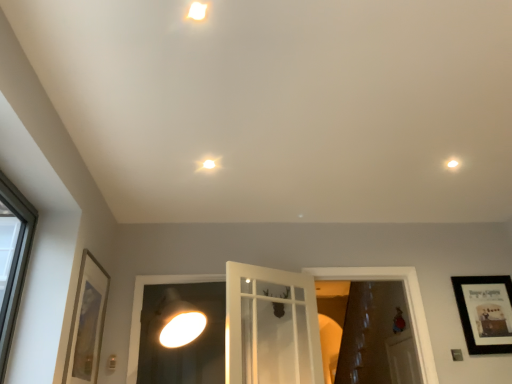
I want to click on white glossy door at center, positioned as the 1th window frame in right-to-left order, so click(x=407, y=301).

Where is `gold-framed picture at left, the 2th picture frame positioned from the back`? The height and width of the screenshot is (384, 512). gold-framed picture at left, the 2th picture frame positioned from the back is located at coordinates (87, 322).

What do you see at coordinates (142, 305) in the screenshot?
I see `white glass door at center, positioned as the second window frame in right-to-left order` at bounding box center [142, 305].

Identify the location of white glossy door at center, positioned as the 1th window frame in right-to-left order. The image size is (512, 384). (407, 301).

Which is in front, point (196, 10) or point (454, 166)?

Positioned in front is point (196, 10).

From the image's perspective, is white glossy droplight at upper center, the 2th droplight when ordered from left to right, above or below white glossy droplight at upper right, the 3th droplight viewed from the left?

white glossy droplight at upper center, the 2th droplight when ordered from left to right, is situated higher than white glossy droplight at upper right, the 3th droplight viewed from the left, in the image.

From a real-world perspective, which is physically above, white glossy droplight at upper center, the 2th droplight when ordered from left to right, or white glossy droplight at upper right, marked as the 3th droplight in a front-to-back arrangement?

white glossy droplight at upper right, marked as the 3th droplight in a front-to-back arrangement, from a real-world perspective.

Which of these two, white glossy droplight at upper center, acting as the 3th droplight starting from the bottom, or white glossy droplight at upper right, marked as the 3th droplight in a front-to-back arrangement, stands taller?

With more height is white glossy droplight at upper right, marked as the 3th droplight in a front-to-back arrangement.

Which object is positioned more to the left, white glossy droplight at upper right, the 1th droplight viewed from the right, or matte white droplight at center, placed as the 1th droplight when sorted from bottom to top?

matte white droplight at center, placed as the 1th droplight when sorted from bottom to top, is more to the left.

From a real-world perspective, is white glossy droplight at upper right, which is counted as the second droplight, starting from the bottom, located higher than matte white droplight at center, placed as the 1th droplight when sorted from bottom to top?

Yes, from a real-world perspective, white glossy droplight at upper right, which is counted as the second droplight, starting from the bottom, is on top of matte white droplight at center, placed as the 1th droplight when sorted from bottom to top.

Is white glossy droplight at upper right, marked as the 3th droplight in a front-to-back arrangement, far away from matte white droplight at center, which appears as the 3th droplight when viewed from the right?

Yes.

In the scene shown: Is gold-framed picture at left, the 2th picture frame positioned from the back, with matte white droplight at center, placed as the 1th droplight when sorted from bottom to top?

They are not placed beside each other.

Who is shorter, gold-framed picture at left, which is counted as the 1th picture frame, starting from the front, or matte white droplight at center, which appears as the third droplight when viewed from the top?

With less height is matte white droplight at center, which appears as the third droplight when viewed from the top.

You are a GUI agent. You are given a task and a screenshot of the screen. Output one action in this format:
    pyautogui.click(x=<x>, y=<y>)
    Task: Click on the 1st droplight behind the gold-framed picture at left, the 2th picture frame positioned from the back
    The image size is (512, 384).
    Given the screenshot: What is the action you would take?
    pyautogui.click(x=209, y=164)

Can you confirm if white glossy door at center, placed as the second window frame when sorted from left to right, is smaller than matte white droplight at center, which appears as the second droplight when viewed from the front?

Incorrect, white glossy door at center, placed as the second window frame when sorted from left to right, is not smaller in size than matte white droplight at center, which appears as the second droplight when viewed from the front.

How different are the orientations of white glossy door at center, positioned as the 1th window frame in right-to-left order, and matte white droplight at center, which appears as the second droplight when viewed from the front, in degrees?

The angle between the facing direction of white glossy door at center, positioned as the 1th window frame in right-to-left order, and the facing direction of matte white droplight at center, which appears as the second droplight when viewed from the front, is 0.7 degrees.

From a real-world perspective, starting from the matte white droplight at center, marked as the 2th droplight in a back-to-front arrangement, which window frame is the 1st one below it? Please provide its 2D coordinates.

[(407, 301)]

Which object is positioned more to the left, white glossy droplight at upper right, the first droplight positioned from the back, or gold-framed picture at left, positioned as the 2th picture frame in right-to-left order?

gold-framed picture at left, positioned as the 2th picture frame in right-to-left order, is more to the left.

Are white glossy droplight at upper right, marked as the 3th droplight in a front-to-back arrangement, and gold-framed picture at left, which is counted as the 1th picture frame, starting from the left, located far from each other?

That's right, there is a large distance between white glossy droplight at upper right, marked as the 3th droplight in a front-to-back arrangement, and gold-framed picture at left, which is counted as the 1th picture frame, starting from the left.

From the image's perspective, is white glossy droplight at upper right, the first droplight positioned from the back, over gold-framed picture at left, the 2th picture frame positioned from the back?

Indeed, from the image's perspective, white glossy droplight at upper right, the first droplight positioned from the back, is shown above gold-framed picture at left, the 2th picture frame positioned from the back.

How many degrees apart are the facing directions of white glossy droplight at upper right, which is counted as the second droplight, starting from the bottom, and gold-framed picture at left, which is counted as the 1th picture frame, starting from the left?

The facing directions of white glossy droplight at upper right, which is counted as the second droplight, starting from the bottom, and gold-framed picture at left, which is counted as the 1th picture frame, starting from the left, are 91.1 degrees apart.

Which of these two, black matte picture frame at upper right, which is counted as the first picture frame, starting from the right, or white glossy droplight at upper right, the first droplight positioned from the back, stands shorter?

white glossy droplight at upper right, the first droplight positioned from the back.

Is black matte picture frame at upper right, which is counted as the first picture frame, starting from the right, facing towards white glossy droplight at upper right, the 3th droplight viewed from the left?

No, black matte picture frame at upper right, which is counted as the first picture frame, starting from the right, is not turned towards white glossy droplight at upper right, the 3th droplight viewed from the left.

Considering the relative sizes of black matte picture frame at upper right, which is counted as the first picture frame, starting from the right, and white glossy droplight at upper right, the 1th droplight viewed from the right, in the image provided, is black matte picture frame at upper right, which is counted as the first picture frame, starting from the right, thinner than white glossy droplight at upper right, the 1th droplight viewed from the right,?

Indeed, black matte picture frame at upper right, which is counted as the first picture frame, starting from the right, has a lesser width compared to white glossy droplight at upper right, the 1th droplight viewed from the right.

Considering the relative positions of black matte picture frame at upper right, the 1th picture frame positioned from the back, and white glossy droplight at upper right, which is counted as the second droplight, starting from the bottom, in the image provided, is black matte picture frame at upper right, the 1th picture frame positioned from the back, to the right of white glossy droplight at upper right, which is counted as the second droplight, starting from the bottom, from the viewer's perspective?

Indeed, black matte picture frame at upper right, the 1th picture frame positioned from the back, is positioned on the right side of white glossy droplight at upper right, which is counted as the second droplight, starting from the bottom.

Looking at this image, from a real-world perspective, does white glass door at center, positioned as the second window frame in right-to-left order, sit lower than white glossy droplight at upper center, acting as the 3th droplight starting from the bottom?

Correct, in the physical world, white glass door at center, positioned as the second window frame in right-to-left order, is lower than white glossy droplight at upper center, acting as the 3th droplight starting from the bottom.

From the image's perspective, which object appears higher, white glass door at center, the first window frame in the left-to-right sequence, or white glossy droplight at upper center, which ranks as the 2th droplight in right-to-left order?

From the image's view, white glossy droplight at upper center, which ranks as the 2th droplight in right-to-left order, is above.

Is white glass door at center, positioned as the second window frame in right-to-left order, wider than white glossy droplight at upper center, the first droplight viewed from the front?

No.

Are white glass door at center, positioned as the second window frame in right-to-left order, and white glossy droplight at upper center, which ranks as the 2th droplight in right-to-left order, far apart?

Yes, white glass door at center, positioned as the second window frame in right-to-left order, and white glossy droplight at upper center, which ranks as the 2th droplight in right-to-left order, are quite far apart.

The image size is (512, 384). I want to click on droplight above the white glossy droplight at upper right, the 1th droplight viewed from the right (from the image's perspective), so click(x=197, y=11).

Where is `the 2nd droplight positioned above the matte white droplight at center, which appears as the 3th droplight when viewed from the right (from a real-world perspective)`? the 2nd droplight positioned above the matte white droplight at center, which appears as the 3th droplight when viewed from the right (from a real-world perspective) is located at coordinates (452, 164).

Looking at the image, which one is located closer to matte white droplight at center, placed as the 1th droplight when sorted from bottom to top, white glossy droplight at upper center, which ranks as the 2th droplight in right-to-left order, or gold-framed picture at left, the 2th picture frame positioned from the back?

white glossy droplight at upper center, which ranks as the 2th droplight in right-to-left order, is positioned closer to the anchor matte white droplight at center, placed as the 1th droplight when sorted from bottom to top.

Estimate the real-world distances between objects in this image. Which object is closer to white glass door at center, the first window frame in the left-to-right sequence, white glossy droplight at upper right, the first droplight positioned from the back, or black matte picture frame at upper right, which ranks as the second picture frame in front-to-back order?

black matte picture frame at upper right, which ranks as the second picture frame in front-to-back order, lies closer to white glass door at center, the first window frame in the left-to-right sequence, than the other object.

Looking at the image, which one is located further to matte white droplight at center, marked as the 2th droplight in a back-to-front arrangement, white glossy door at center, positioned as the 1th window frame in right-to-left order, or white glossy droplight at upper center, which appears as the first droplight when viewed from the top?

white glossy door at center, positioned as the 1th window frame in right-to-left order, is positioned further to the anchor matte white droplight at center, marked as the 2th droplight in a back-to-front arrangement.

Looking at this image, which object lies further to the anchor point gold-framed picture at left, positioned as the 2th picture frame in right-to-left order, white glossy droplight at upper center, which appears as the first droplight when viewed from the top, or white glossy droplight at upper right, the 2th droplight viewed from the top?

white glossy droplight at upper right, the 2th droplight viewed from the top, is further to gold-framed picture at left, positioned as the 2th picture frame in right-to-left order.

Considering their positions, is matte white droplight at center, which appears as the second droplight when viewed from the front, positioned further to white glossy door at center, positioned as the 1th window frame in right-to-left order, than gold-framed picture at left, positioned as the 2th picture frame in right-to-left order?

gold-framed picture at left, positioned as the 2th picture frame in right-to-left order.

Considering their positions, is gold-framed picture at left, positioned as the 2th picture frame in right-to-left order, positioned further to matte white droplight at center, placed as the first droplight when sorted from left to right, than white glossy droplight at upper right, the 2th droplight viewed from the top?

white glossy droplight at upper right, the 2th droplight viewed from the top, lies further to matte white droplight at center, placed as the first droplight when sorted from left to right, than the other object.

From the picture: Based on their spatial positions, is white glossy door at center, placed as the second window frame when sorted from left to right, or white glossy droplight at upper center, the 2th droplight when ordered from left to right, further from white glossy droplight at upper right, the first droplight positioned from the back?

Among the two, white glossy droplight at upper center, the 2th droplight when ordered from left to right, is located further to white glossy droplight at upper right, the first droplight positioned from the back.

Considering their positions, is white glass door at center, positioned as the second window frame in right-to-left order, positioned further to matte white droplight at center, placed as the first droplight when sorted from left to right, than white glossy door at center, positioned as the 1th window frame in right-to-left order?

The object further to matte white droplight at center, placed as the first droplight when sorted from left to right, is white glossy door at center, positioned as the 1th window frame in right-to-left order.

You are a GUI agent. You are given a task and a screenshot of the screen. Output one action in this format:
    pyautogui.click(x=<x>, y=<y>)
    Task: Click on the window frame between white glossy droplight at upper center, acting as the 3th droplight starting from the bottom, and black matte picture frame at upper right, the 1th picture frame positioned from the back, from left to right
    Image resolution: width=512 pixels, height=384 pixels.
    Given the screenshot: What is the action you would take?
    pyautogui.click(x=407, y=301)

Locate an element on the screen. This screenshot has height=384, width=512. window frame between gold-framed picture at left, positioned as the 2th picture frame in right-to-left order, and white glossy door at center, positioned as the 1th window frame in right-to-left order, from left to right is located at coordinates (142, 305).

Identify the location of window frame between white glossy droplight at upper center, the third droplight positioned from the back, and white glossy door at center, placed as the second window frame when sorted from left to right, vertically. The height and width of the screenshot is (384, 512). (142, 305).

The image size is (512, 384). I want to click on window frame located between white glass door at center, the first window frame in the left-to-right sequence, and black matte picture frame at upper right, which ranks as the second picture frame in front-to-back order, in the left-right direction, so click(407, 301).